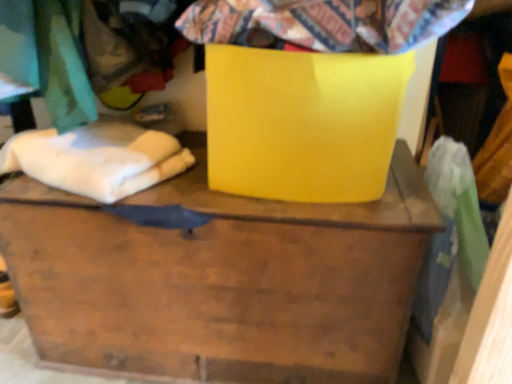
What do you see at coordinates (302, 122) in the screenshot? I see `glossy yellow cardboard box at center` at bounding box center [302, 122].

Describe the element at coordinates (221, 280) in the screenshot. I see `matte yellow container at center` at that location.

Find the location of a particular element. This screenshot has width=512, height=384. white soft cloth at left is located at coordinates (97, 158).

Measure the distance between point (58, 140) and camera.

Point (58, 140) and camera are 38.50 inches apart from each other.

Where is `glossy yellow cardboard box at center`? The height and width of the screenshot is (384, 512). glossy yellow cardboard box at center is located at coordinates (302, 122).

How different are the orientations of glossy yellow cardboard box at center and matte yellow container at center in degrees?

1.28 degrees separate the facing orientations of glossy yellow cardboard box at center and matte yellow container at center.

Could you tell me if glossy yellow cardboard box at center is facing matte yellow container at center?

No, glossy yellow cardboard box at center is not facing towards matte yellow container at center.

Between glossy yellow cardboard box at center and matte yellow container at center, which one has larger size?

With larger size is matte yellow container at center.

Who is bigger, white soft cloth at left or matte yellow container at center?

matte yellow container at center is bigger.

Between white soft cloth at left and matte yellow container at center, which one has less height?

Standing shorter between the two is white soft cloth at left.

From a real-world perspective, is white soft cloth at left positioned under matte yellow container at center based on gravity?

No, from a real-world perspective, white soft cloth at left is not below matte yellow container at center.

Would you say flannel fabric at upper center contains white soft cloth at left?

No, white soft cloth at left is not a part of flannel fabric at upper center.

From the image's perspective, is flannel fabric at upper center below white soft cloth at left?

No, from the image's perspective, flannel fabric at upper center is not beneath white soft cloth at left.

Is flannel fabric at upper center oriented away from white soft cloth at left?

No, flannel fabric at upper center is not facing away from white soft cloth at left.

At what (x,y) coordinates should I click in order to perform the action: click on linen above the matte yellow container at center (from a real-world perspective). Please return your answer as a coordinate pair (x, y). Image resolution: width=512 pixels, height=384 pixels. Looking at the image, I should click on 97,158.

Is matte yellow container at center shorter than white soft cloth at left?

Incorrect, the height of matte yellow container at center does not fall short of that of white soft cloth at left.

Are matte yellow container at center and white soft cloth at left far apart?

No, matte yellow container at center is in close proximity to white soft cloth at left.

Is matte yellow container at center closer to the viewer compared to white soft cloth at left?

Yes, it is in front of white soft cloth at left.

Is glossy yellow cardboard box at center facing away from white soft cloth at left?

No.

Can you confirm if glossy yellow cardboard box at center is taller than white soft cloth at left?

Yes.

Based on the photo, would you say glossy yellow cardboard box at center is a long distance from white soft cloth at left?

No, glossy yellow cardboard box at center is not far away from white soft cloth at left.

Is glossy yellow cardboard box at center at the left side of white soft cloth at left?

Incorrect, glossy yellow cardboard box at center is not on the left side of white soft cloth at left.

Which is in front, glossy yellow cardboard box at center or flannel fabric at upper center?

Positioned in front is flannel fabric at upper center.

Is glossy yellow cardboard box at center touching flannel fabric at upper center?

No, glossy yellow cardboard box at center is not making contact with flannel fabric at upper center.

In the scene shown: What's the angular difference between glossy yellow cardboard box at center and flannel fabric at upper center's facing directions?

The angular difference between glossy yellow cardboard box at center and flannel fabric at upper center is 10.4 degrees.

Does white soft cloth at left have a lesser height compared to flannel fabric at upper center?

No, white soft cloth at left is not shorter than flannel fabric at upper center.

From the image's perspective, which object appears higher, white soft cloth at left or flannel fabric at upper center?

flannel fabric at upper center appears higher in the image.

From a real-world perspective, is white soft cloth at left below flannel fabric at upper center?

Correct, in the physical world, white soft cloth at left is lower than flannel fabric at upper center.

Is white soft cloth at left facing away from flannel fabric at upper center?

That's not correct — white soft cloth at left is not looking away from flannel fabric at upper center.

The image size is (512, 384). I want to click on furniture below the glossy yellow cardboard box at center (from a real-world perspective), so click(221, 280).

Where is `linen that appears above the matte yellow container at center (from the image's perspective)`? This screenshot has height=384, width=512. linen that appears above the matte yellow container at center (from the image's perspective) is located at coordinates [97, 158].

Based on their spatial positions, is flannel fabric at upper center or glossy yellow cardboard box at center closer to matte yellow container at center?

Among the two, glossy yellow cardboard box at center is located nearer to matte yellow container at center.

Estimate the real-world distances between objects in this image. Which object is closer to glossy yellow cardboard box at center, flannel fabric at upper center or white soft cloth at left?

flannel fabric at upper center lies closer to glossy yellow cardboard box at center than the other object.

Considering their positions, is white soft cloth at left positioned closer to matte yellow container at center than glossy yellow cardboard box at center?

glossy yellow cardboard box at center.

When comparing their distances from glossy yellow cardboard box at center, does matte yellow container at center or white soft cloth at left seem further?

Based on the image, white soft cloth at left appears to be further to glossy yellow cardboard box at center.

From the picture: Looking at the image, which one is located closer to white soft cloth at left, matte yellow container at center or glossy yellow cardboard box at center?

The object closer to white soft cloth at left is matte yellow container at center.

Which object lies further to the anchor point flannel fabric at upper center, white soft cloth at left or glossy yellow cardboard box at center?

white soft cloth at left.

Considering their positions, is matte yellow container at center positioned further to flannel fabric at upper center than glossy yellow cardboard box at center?

Based on the image, matte yellow container at center appears to be further to flannel fabric at upper center.

Estimate the real-world distances between objects in this image. Which object is further from glossy yellow cardboard box at center, matte yellow container at center or flannel fabric at upper center?

matte yellow container at center is positioned further to the anchor glossy yellow cardboard box at center.

Locate an element on the screen. cardboard box between white soft cloth at left and flannel fabric at upper center in the horizontal direction is located at coordinates (302, 122).

This screenshot has width=512, height=384. In order to click on cardboard box between flannel fabric at upper center and matte yellow container at center in the vertical direction in this screenshot , I will do `click(302, 122)`.

This screenshot has width=512, height=384. I want to click on furniture between white soft cloth at left and glossy yellow cardboard box at center from left to right, so click(221, 280).

In order to click on linen between flannel fabric at upper center and matte yellow container at center in the up-down direction in this screenshot , I will do `click(97, 158)`.